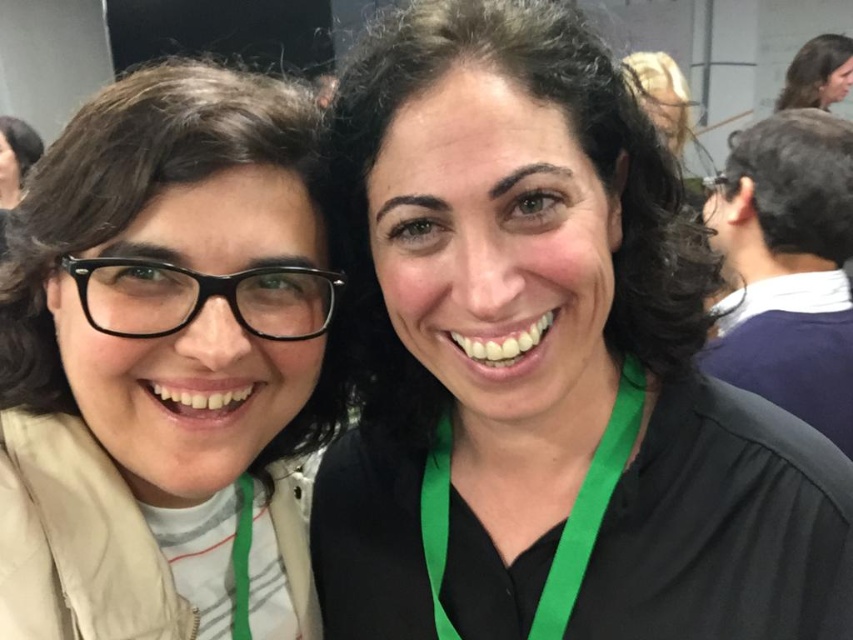
You are a photographer trying to capture a closeup of the matte black glasses at left and the green fabric lanyard at center. Which object should you focus on first if you want to ensure both are in focus without adjusting the camera settings?

The matte black glasses at left has a greater height compared to the green fabric lanyard at center, so focusing on the taller matte black glasses at left first would help ensure both are in focus since it is farther away and requires a deeper depth of field.

You are standing in front of the photograph and want to locate the black matte shirt at center. According to the coordinates provided, where exactly would you find it?

The black matte shirt at center is located at point coordinates 0.570 in the x axis and 0.641 in the y axis.